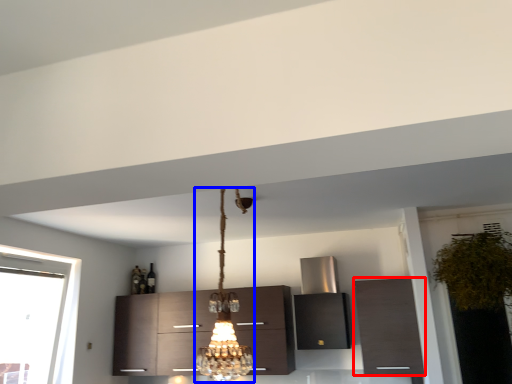
Question: Which of the following is the closest to the observer, cabinetry (highlighted by a red box) or lamp (highlighted by a blue box)?

Choices:
 (A) cabinetry
 (B) lamp

Answer: (B)